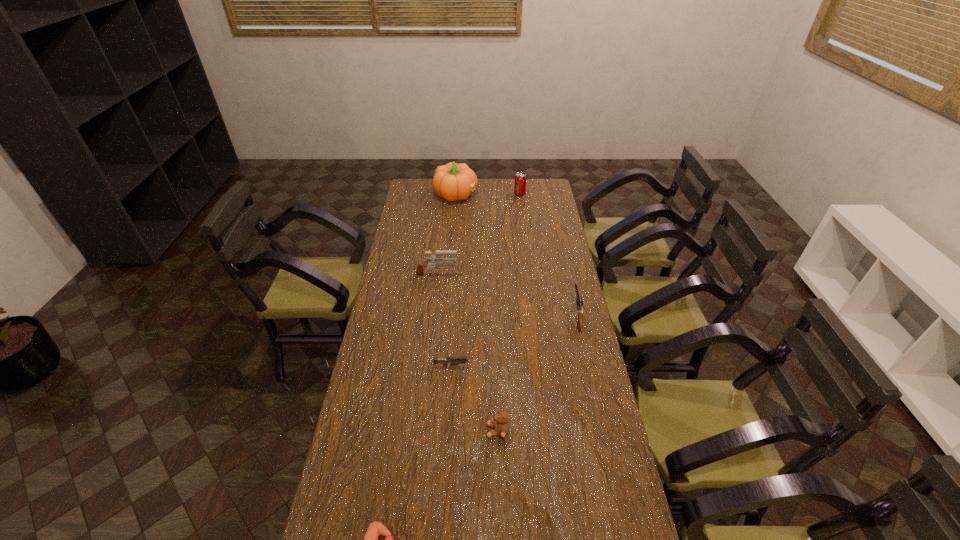
Locate an element on the screen. pumpkin that is at the far edge is located at coordinates (453, 181).

Locate an element on the screen. The height and width of the screenshot is (540, 960). soda can that is positioned at the far edge is located at coordinates (520, 178).

Locate an element on the screen. This screenshot has height=540, width=960. pumpkin that is at the left edge is located at coordinates (453, 181).

Identify the location of gun that is at the left edge. The height and width of the screenshot is (540, 960). [439, 260].

The width and height of the screenshot is (960, 540). Identify the location of soda can present at the right edge. (520, 178).

I want to click on gun located in the right edge section of the desktop, so click(579, 302).

Locate an element on the screen. The image size is (960, 540). object that is at the far left corner is located at coordinates (453, 181).

Where is `object that is at the far right corner`? The image size is (960, 540). object that is at the far right corner is located at coordinates (520, 178).

You are a GUI agent. You are given a task and a screenshot of the screen. Output one action in this format:
    pyautogui.click(x=<x>, y=<y>)
    Task: Click on the vacant space at the far edge of the desktop
    The image size is (960, 540).
    Given the screenshot: What is the action you would take?
    pyautogui.click(x=495, y=181)

This screenshot has width=960, height=540. In order to click on free space at the left edge in this screenshot , I will do `click(394, 378)`.